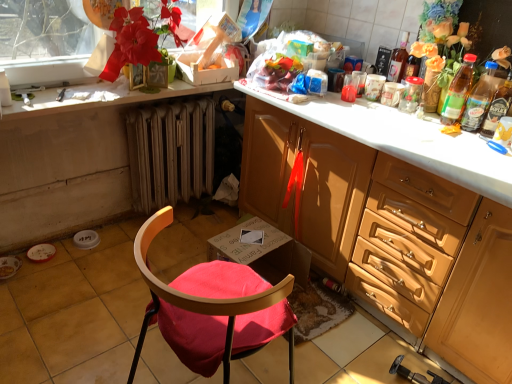
Question: Could you tell me if translucent plastic bottle at right, the 2th bottle positioned from the right, is turned towards transparent plastic jar at upper right?

Choices:
 (A) no
 (B) yes

Answer: (A)

Question: Is translucent plastic bottle at right, the 2th bottle positioned from the right, far from transparent plastic jar at upper right?

Choices:
 (A) no
 (B) yes

Answer: (A)

Question: Is the surface of translucent plastic bottle at right, which is the 3th bottle from left to right, in direct contact with transparent plastic jar at upper right?

Choices:
 (A) yes
 (B) no

Answer: (B)

Question: Does translucent plastic bottle at right, the 2th bottle positioned from the right, come in front of transparent plastic jar at upper right?

Choices:
 (A) yes
 (B) no

Answer: (A)

Question: Can you confirm if translucent plastic bottle at right, which is the 3th bottle from left to right, is wider than transparent plastic jar at upper right?

Choices:
 (A) yes
 (B) no

Answer: (B)

Question: Considering the positions of transparent plastic window screen at upper left and transparent plastic jar at upper right in the image, is transparent plastic window screen at upper left taller or shorter than transparent plastic jar at upper right?

Choices:
 (A) tall
 (B) short

Answer: (A)

Question: Is transparent plastic window screen at upper left inside the boundaries of transparent plastic jar at upper right, or outside?

Choices:
 (A) outside
 (B) inside

Answer: (A)

Question: Does point (89, 23) appear closer or farther from the camera than point (419, 96)?

Choices:
 (A) farther
 (B) closer

Answer: (A)

Question: Considering the positions of transparent plastic window screen at upper left and transparent plastic jar at upper right in the image, is transparent plastic window screen at upper left bigger or smaller than transparent plastic jar at upper right?

Choices:
 (A) big
 (B) small

Answer: (A)

Question: Is translucent glass bottle at upper right, acting as the 1th bottle starting from the left, wider or thinner than velvet red chair at lower left?

Choices:
 (A) wide
 (B) thin

Answer: (B)

Question: Looking at the image, does translucent glass bottle at upper right, arranged as the 4th bottle when viewed from the right, seem bigger or smaller compared to velvet red chair at lower left?

Choices:
 (A) big
 (B) small

Answer: (B)

Question: Is translucent glass bottle at upper right, arranged as the 4th bottle when viewed from the right, taller or shorter than velvet red chair at lower left?

Choices:
 (A) tall
 (B) short

Answer: (B)

Question: Is point (394, 64) positioned closer to the camera than point (202, 329)?

Choices:
 (A) closer
 (B) farther

Answer: (B)

Question: Considering the positions of translucent plastic bottle at upper right, which appears as the third bottle when viewed from the right, and metallic radiator at lower center in the image, is translucent plastic bottle at upper right, which appears as the third bottle when viewed from the right, taller or shorter than metallic radiator at lower center?

Choices:
 (A) short
 (B) tall

Answer: (A)

Question: Considering the relative positions of translucent plastic bottle at upper right, which ranks as the 2th bottle in left-to-right order, and metallic radiator at lower center in the image provided, is translucent plastic bottle at upper right, which ranks as the 2th bottle in left-to-right order, to the left or to the right of metallic radiator at lower center?

Choices:
 (A) left
 (B) right

Answer: (B)